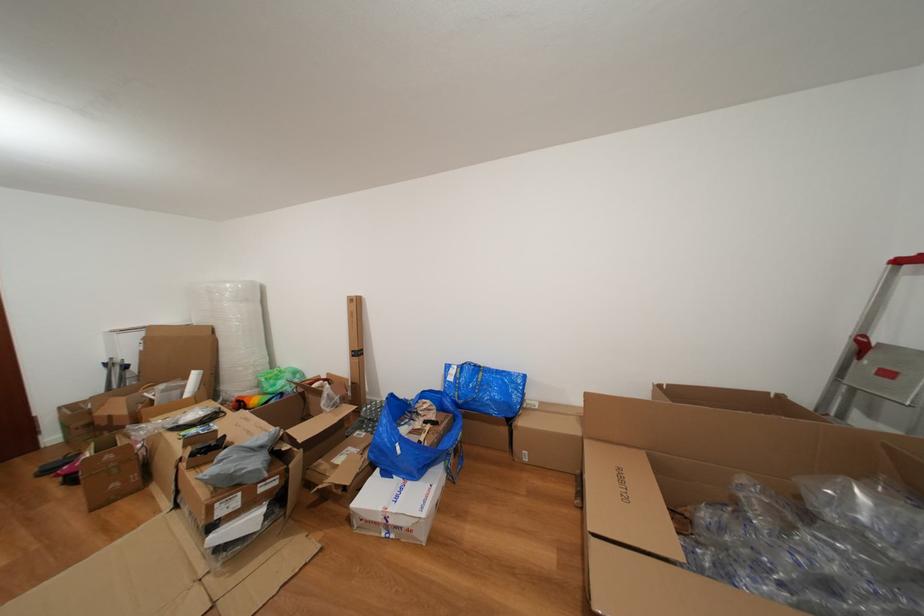
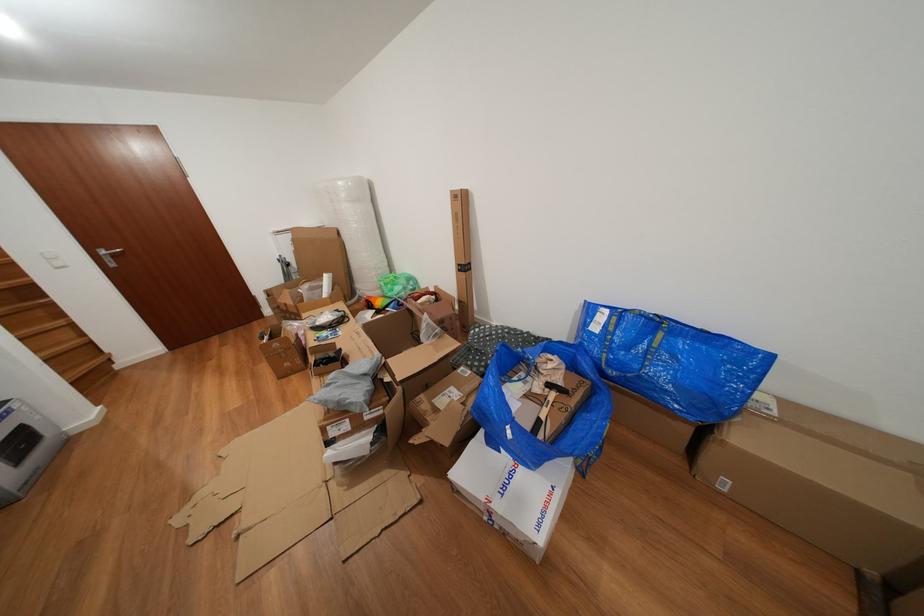
In the second image, find the point that corresponds to (360,361) in the first image.

(468, 276)